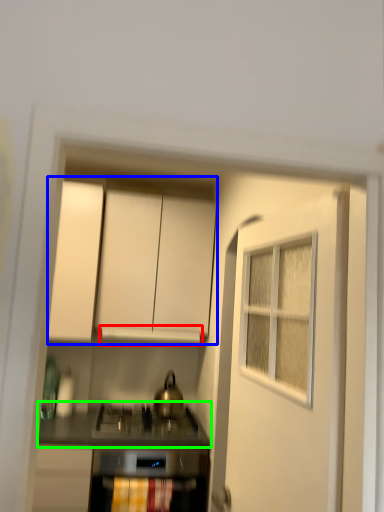
Question: Considering the real-world distances, which object is closest to vent (highlighted by a red box)? cabinetry (highlighted by a blue box) or countertop (highlighted by a green box).

Choices:
 (A) cabinetry
 (B) countertop

Answer: (A)